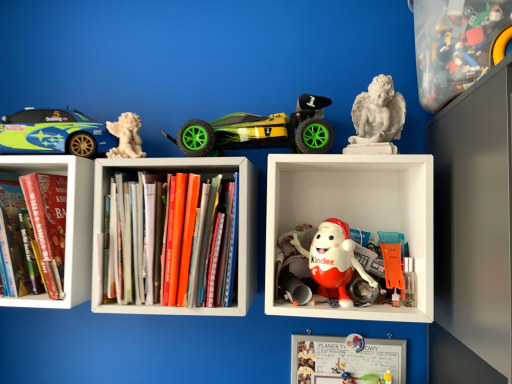
Question: Should I look upward or downward to see matte green and blue car at left?

Choices:
 (A) up
 (B) down

Answer: (A)

Question: Does green matte toy car at center, which is counted as the 2th toy, starting from the left, have a lesser width compared to hardcover books at center, which is counted as the 2th book, starting from the left?

Choices:
 (A) no
 (B) yes

Answer: (A)

Question: Can you confirm if green matte toy car at center, placed as the fourth toy when sorted from right to left, is positioned to the left of hardcover books at center, the 1th book in the right-to-left sequence?

Choices:
 (A) yes
 (B) no

Answer: (B)

Question: From the image's perspective, would you say green matte toy car at center, which is counted as the 2th toy, starting from the left, is shown under hardcover books at center, the 1th book in the right-to-left sequence?

Choices:
 (A) no
 (B) yes

Answer: (A)

Question: From a real-world perspective, is green matte toy car at center, which is counted as the 2th toy, starting from the left, positioned under hardcover books at center, which is counted as the 2th book, starting from the left, based on gravity?

Choices:
 (A) yes
 (B) no

Answer: (B)

Question: Is green matte toy car at center, which is counted as the 2th toy, starting from the left, smaller than hardcover books at center, the 1th book in the right-to-left sequence?

Choices:
 (A) no
 (B) yes

Answer: (B)

Question: Is green matte toy car at center, which is counted as the 2th toy, starting from the left, aimed at hardcover books at center, which is counted as the 2th book, starting from the left?

Choices:
 (A) no
 (B) yes

Answer: (A)

Question: Does white marble angel at upper left, which ranks as the 1th toy in left-to-right order, have a lesser width compared to white plastic kinder egg at center?

Choices:
 (A) no
 (B) yes

Answer: (B)

Question: Can you confirm if white marble angel at upper left, which ranks as the 1th toy in left-to-right order, is positioned to the right of white plastic kinder egg at center?

Choices:
 (A) yes
 (B) no

Answer: (B)

Question: From a real-world perspective, is white marble angel at upper left, which ranks as the 1th toy in left-to-right order, beneath white plastic kinder egg at center?

Choices:
 (A) no
 (B) yes

Answer: (A)

Question: Can you confirm if white marble angel at upper left, marked as the fifth toy in a right-to-left arrangement, is wider than white plastic kinder egg at center?

Choices:
 (A) no
 (B) yes

Answer: (A)

Question: Is white marble angel at upper left, marked as the fifth toy in a right-to-left arrangement, looking in the opposite direction of white plastic kinder egg at center?

Choices:
 (A) no
 (B) yes

Answer: (A)

Question: Is white plastic kinder egg at center located within white marble angel at upper left, marked as the fifth toy in a right-to-left arrangement?

Choices:
 (A) yes
 (B) no

Answer: (B)

Question: Is white marble angel at upper left, which ranks as the 1th toy in left-to-right order, positioned in front of whiteboard at center?

Choices:
 (A) yes
 (B) no

Answer: (A)